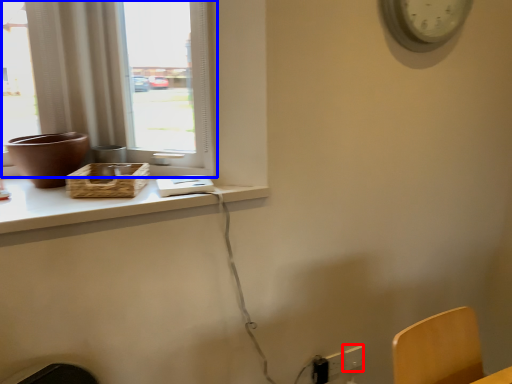
Question: Which of the following is the farthest to the observer, electric outlet (highlighted by a red box) or window (highlighted by a blue box)?

Choices:
 (A) electric outlet
 (B) window

Answer: (A)